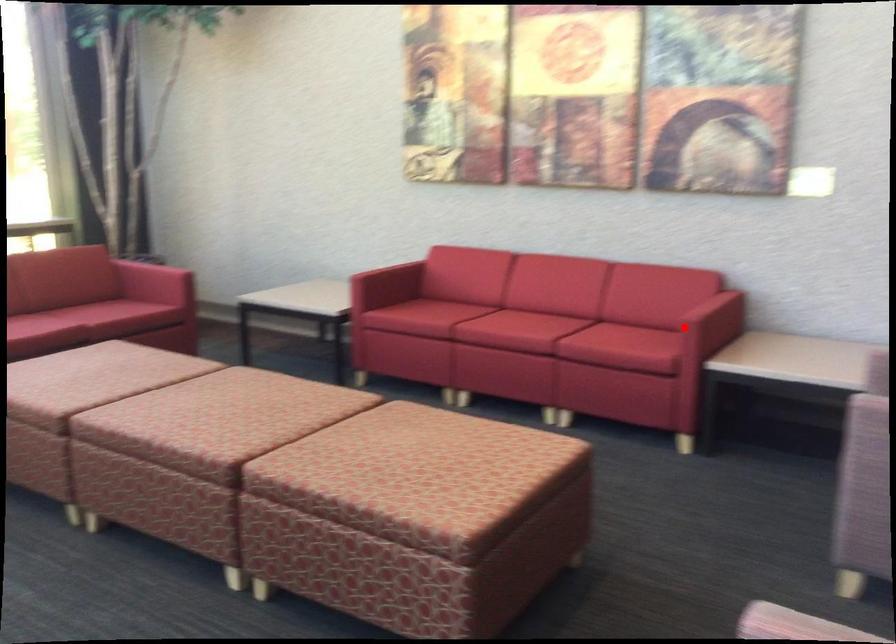
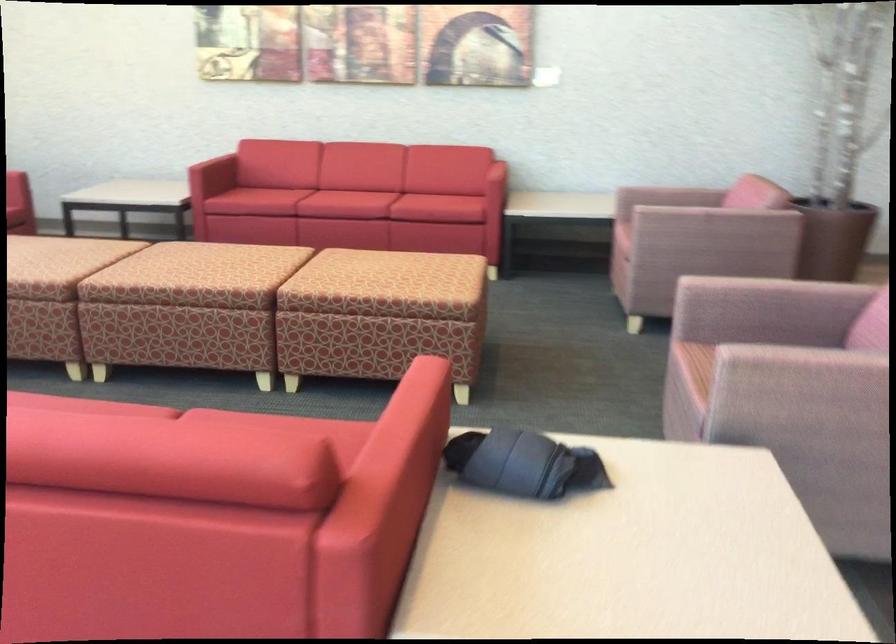
Question: I am providing you with two images of the same scene from different viewpoints. In image1, a red point is highlighted. Considering the same 3D point in image2, which of the following is correct?

Choices:
 (A) It is closer
 (B) It is farther

Answer: (B)